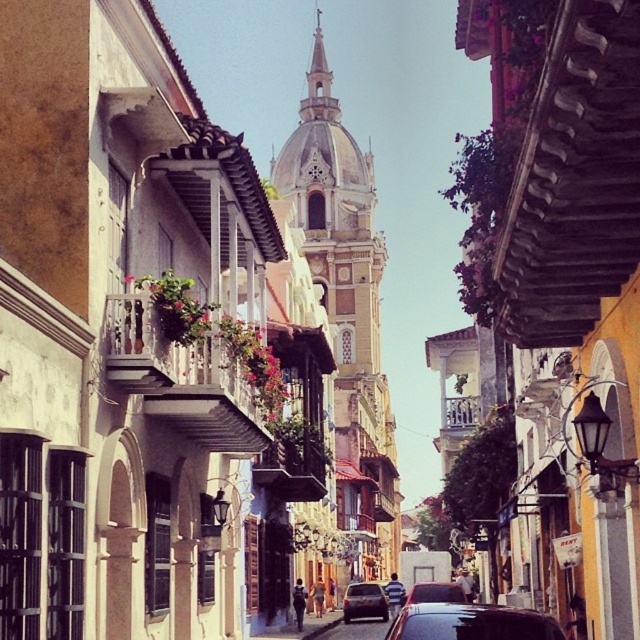
You are a tourist standing at the entrance of the historic district. You see the shiny black car at center. Can you estimate the car position in the image using coordinates?

The shiny black car at center is located at coordinates point (x=472, y=621).

You are a tourist standing at the entrance of the street, and you want to take a photo of the shiny black car at center and the church tower in the background. Can you fit both in your camera frame if your camera has a maximum angle of view of 60 degrees?

The distance between the shiny black car at center and the church tower is 118.33 feet. With a 60 degree angle of view, the camera can capture objects up to 118.33 feet apart, so yes, both the shiny black car at center and the church tower can be included in the photo.

You are standing on a historic street in a Latin American city. There is a point marked at coordinates point (381,604). If you want to take a photo of this point from where you are standing, will it be in focus if your camera has a depth of field that can clearly capture objects up to 300 feet away?

The point (381,604) is 324.03 feet from the camera. Since the camera can only clearly capture objects up to 300 feet away, the point will be out of focus.